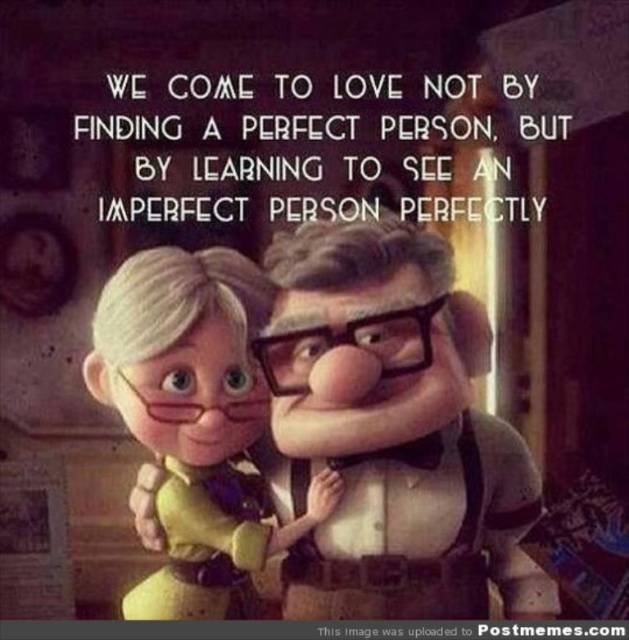
You are an interior designer working on a cozy cabin theme. You have a matte yellow dress at center and a white paper at center. Where should you place a new decorative item so it won not block the view of both objects?

Place the new decorative item above the white paper at center, since the matte yellow dress at center is located below it, ensuring the decorative item won not block either object.

You are a photographer setting up a photo shoot in this cozy cabin scene. You have a matte yellow dress at center and a white paper at center. Since you need to arrange them so that one is taller than the other, which object should you place higher to match the scene?

The matte yellow dress at center is much taller than the white paper at center, so you should place the matte yellow dress at center higher than the white paper at center to match the scene.